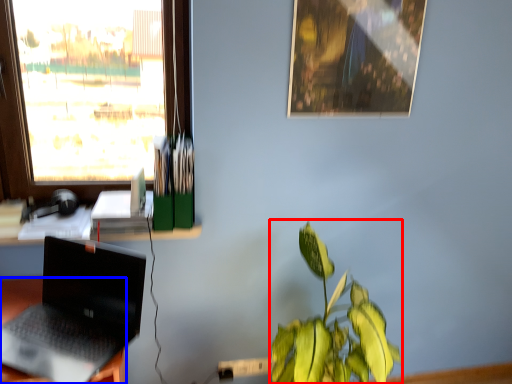
Question: Which object appears farthest to the camera in this image, houseplant (highlighted by a red box) or desk (highlighted by a blue box)?

Choices:
 (A) houseplant
 (B) desk

Answer: (B)